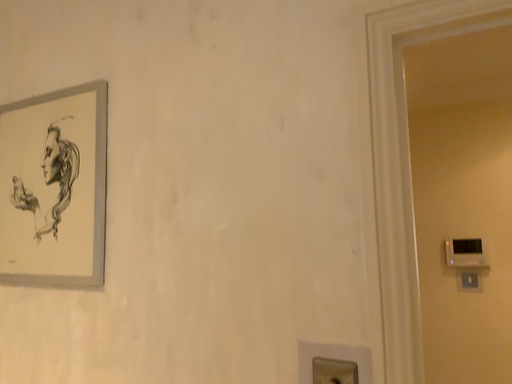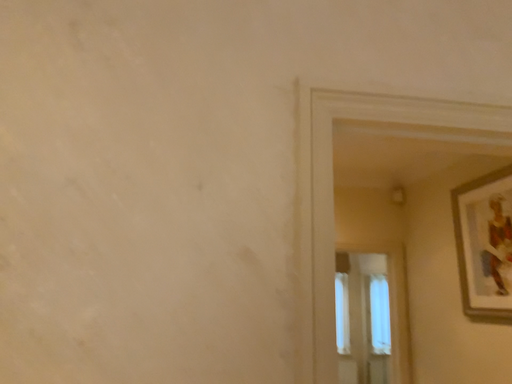
Question: How did the camera likely rotate when shooting the video?

Choices:
 (A) rotated left
 (B) rotated right

Answer: (B)